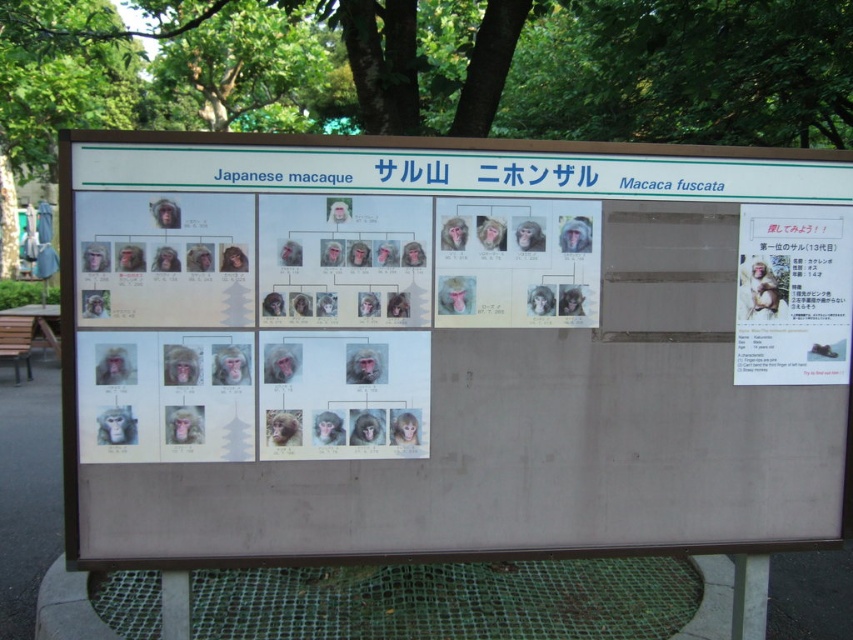
Which is in front, point (775, 432) or point (815, 298)?

Positioned in front is point (815, 298).

Does point (173, 209) come behind point (792, 374)?

No, it is in front of (792, 374).

Measure the distance between point (412,452) and camera.

They are 2.98 meters apart.

At what (x,y) coordinates should I click in order to perform the action: click on white paper at center. Please return your answer as a coordinate pair (x, y). The image size is (853, 640). Looking at the image, I should click on (450, 346).